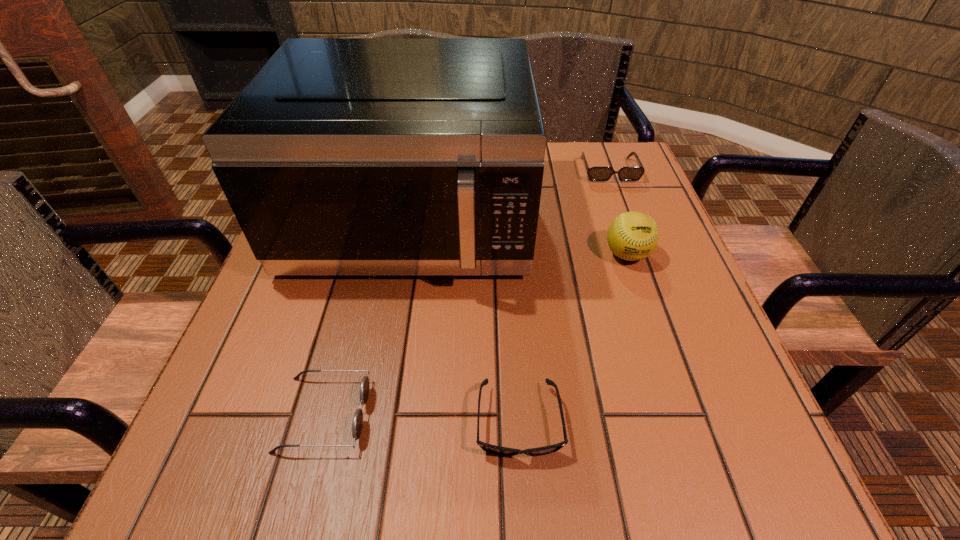
This screenshot has height=540, width=960. Find the location of `blank space at the near left corner`. blank space at the near left corner is located at coordinates (212, 457).

The width and height of the screenshot is (960, 540). I want to click on free space at the far right corner of the desktop, so click(579, 146).

Locate an element on the screen. Image resolution: width=960 pixels, height=540 pixels. blank region between the second tallest object and the second sunglasses from right to left is located at coordinates (573, 338).

The height and width of the screenshot is (540, 960). Identify the location of empty location between the second sunglasses from left to right and the tallest object. (465, 322).

Identify the location of free spot between the second sunglasses from right to left and the farthest sunglasses. The image size is (960, 540). (564, 296).

Identify the location of free point between the second sunglasses from right to left and the softball. The image size is (960, 540). (573, 338).

The height and width of the screenshot is (540, 960). In order to click on free spot between the second sunglasses from right to left and the farthest sunglasses in this screenshot , I will do `click(564, 296)`.

Locate an element on the screen. free area in between the second sunglasses from left to right and the softball is located at coordinates (573, 338).

Locate an element on the screen. The height and width of the screenshot is (540, 960). free space between the second sunglasses from right to left and the leftmost sunglasses is located at coordinates (421, 418).

The height and width of the screenshot is (540, 960). I want to click on free area in between the second sunglasses from right to left and the leftmost sunglasses, so click(421, 418).